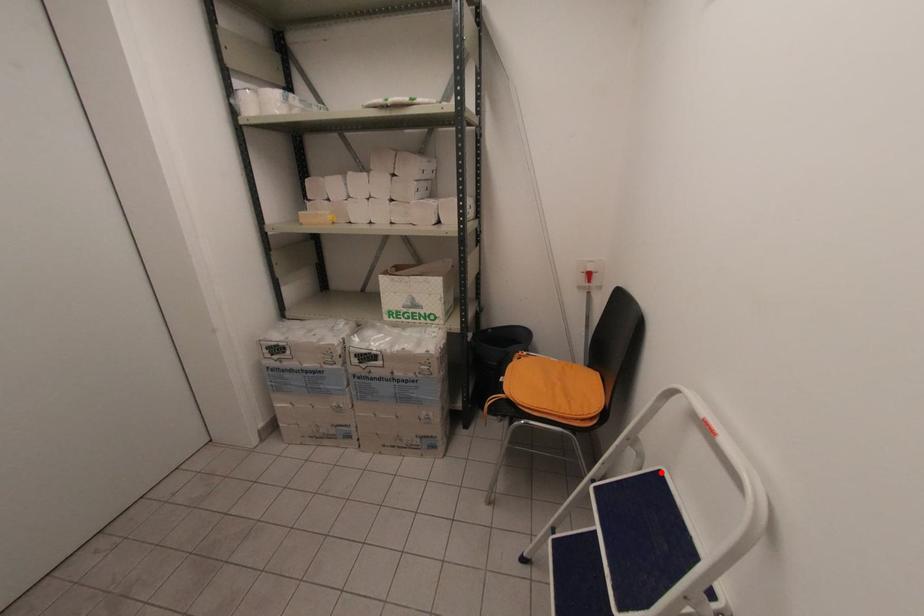
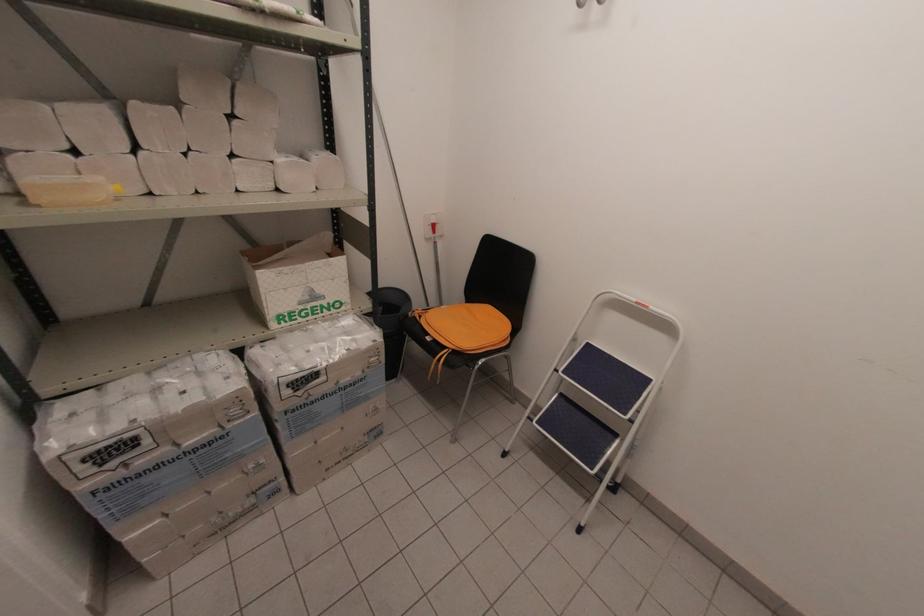
Question: I am providing you with two images of the same scene from different viewpoints. In image1, a red point is highlighted. Considering the same 3D point in image2, which of the following is correct?

Choices:
 (A) It is closer
 (B) It is farther

Answer: (B)